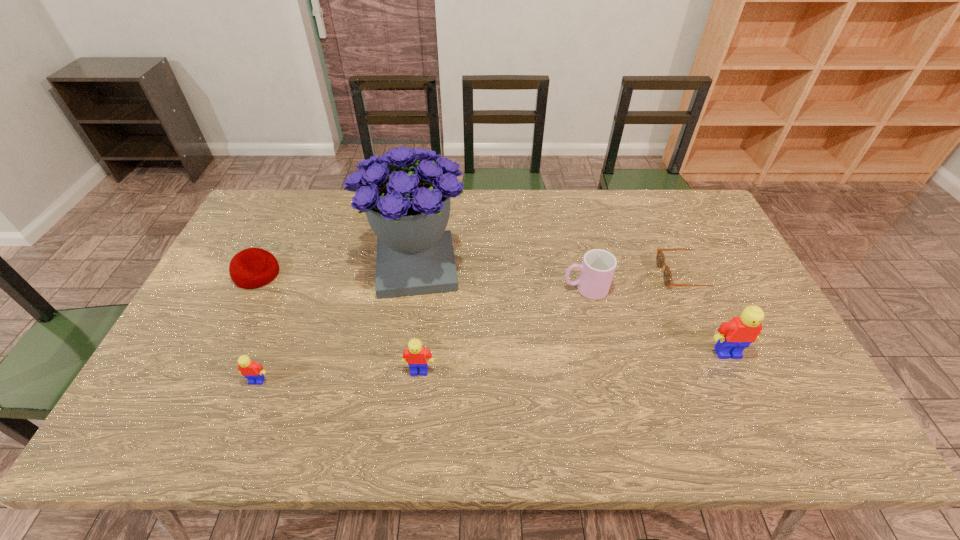
The image size is (960, 540). What are the coordinates of `the shortest object` in the screenshot? It's located at (660, 258).

Locate an element on the screen. vacant point located on the front-facing side of the farthest Lego is located at coordinates (751, 403).

The image size is (960, 540). I want to click on vacant space located 0.110m with the handle on the side of the cup, so click(x=525, y=289).

At what (x,y) coordinates should I click in order to perform the action: click on vacant region located with the handle on the side of the cup. Please return your answer as a coordinate pair (x, y). The image size is (960, 540). Looking at the image, I should click on (468, 289).

Where is `vacant space situated 0.200m with the handle on the side of the cup`? This screenshot has width=960, height=540. vacant space situated 0.200m with the handle on the side of the cup is located at coordinates (494, 289).

Image resolution: width=960 pixels, height=540 pixels. Find the location of `vacant space situated 0.090m on the seat area of the sixth tallest object`. vacant space situated 0.090m on the seat area of the sixth tallest object is located at coordinates (309, 274).

Where is `vacant region located 0.390m on the left of the bouquet`? The image size is (960, 540). vacant region located 0.390m on the left of the bouquet is located at coordinates (239, 267).

The width and height of the screenshot is (960, 540). I want to click on free location located on the front-facing side of the sunglasses, so click(x=532, y=275).

This screenshot has height=540, width=960. In order to click on vacant space located on the front-facing side of the sunglasses in this screenshot , I will do pyautogui.click(x=585, y=275).

Where is `vacant space situated on the front-facing side of the sunglasses`? This screenshot has width=960, height=540. vacant space situated on the front-facing side of the sunglasses is located at coordinates (611, 275).